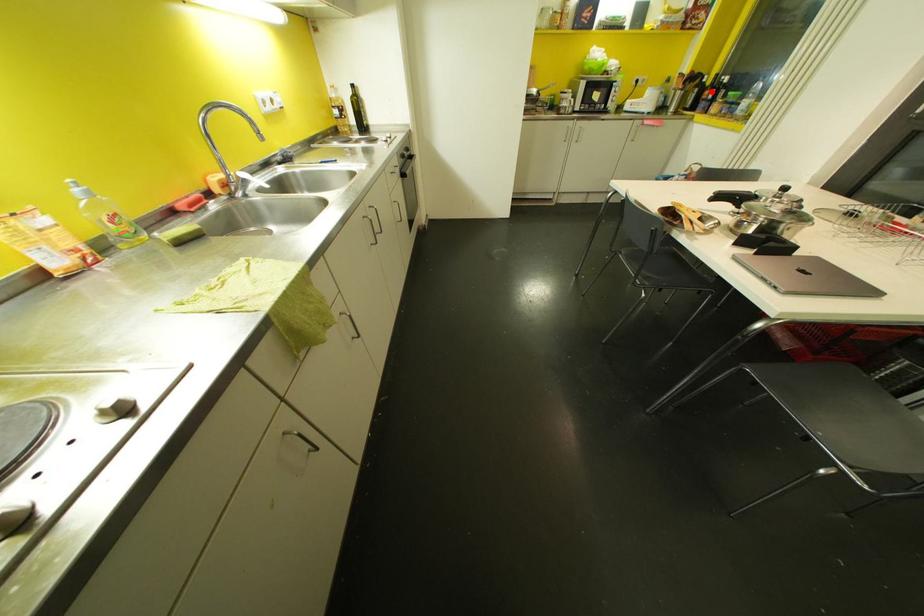
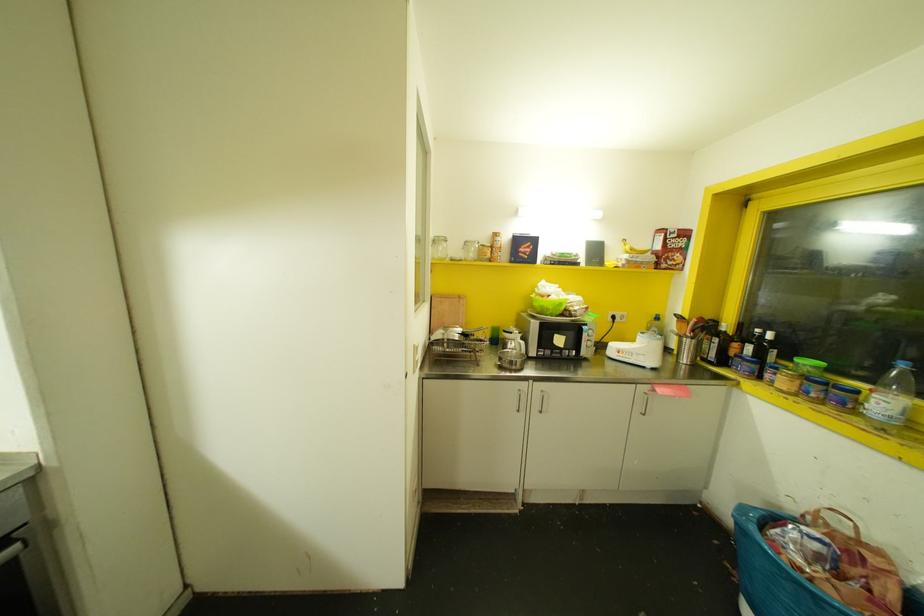
Find the pixel in the second image that matches the highlighted location in the first image.

(748, 347)